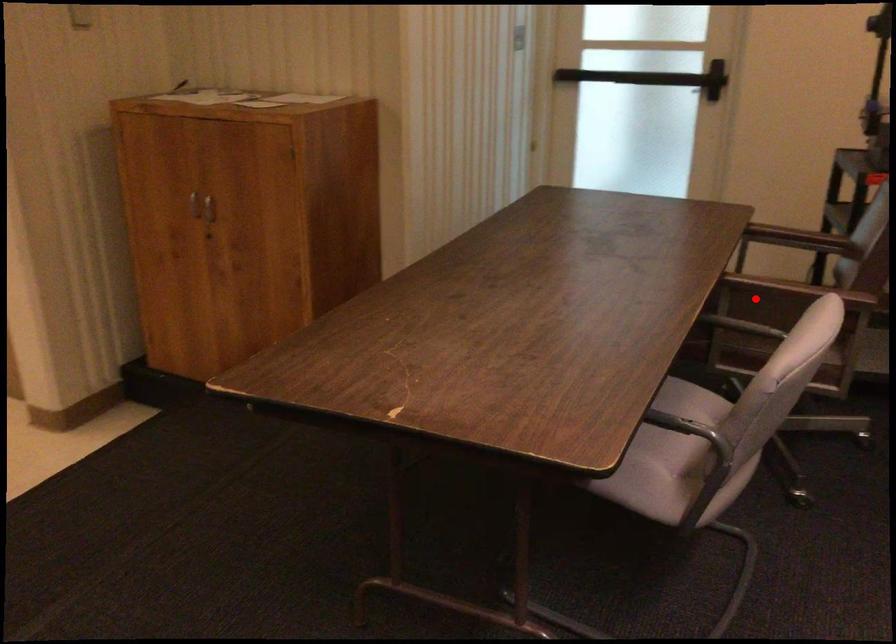
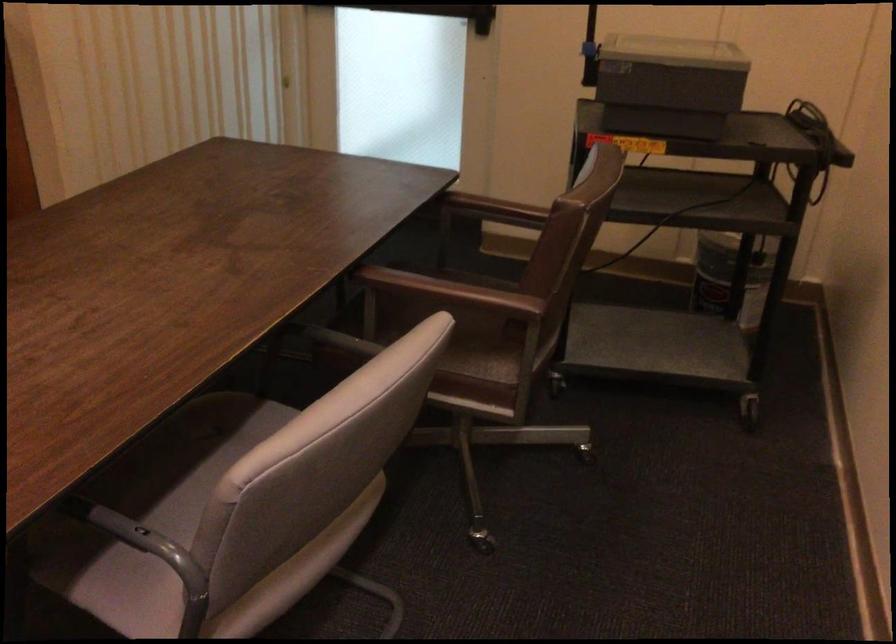
Question: A red point is marked in image1. In image2, is the corresponding 3D point closer to the camera or farther? Reply with the corresponding letter.

Choices:
 (A) The corresponding 3D point is closer.
 (B) The corresponding 3D point is farther.

Answer: (A)